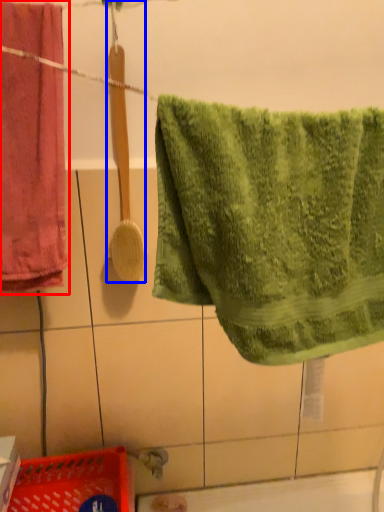
Question: Among these objects, which one is farthest to the camera, towel (highlighted by a red box) or brush (highlighted by a blue box)?

Choices:
 (A) towel
 (B) brush

Answer: (B)